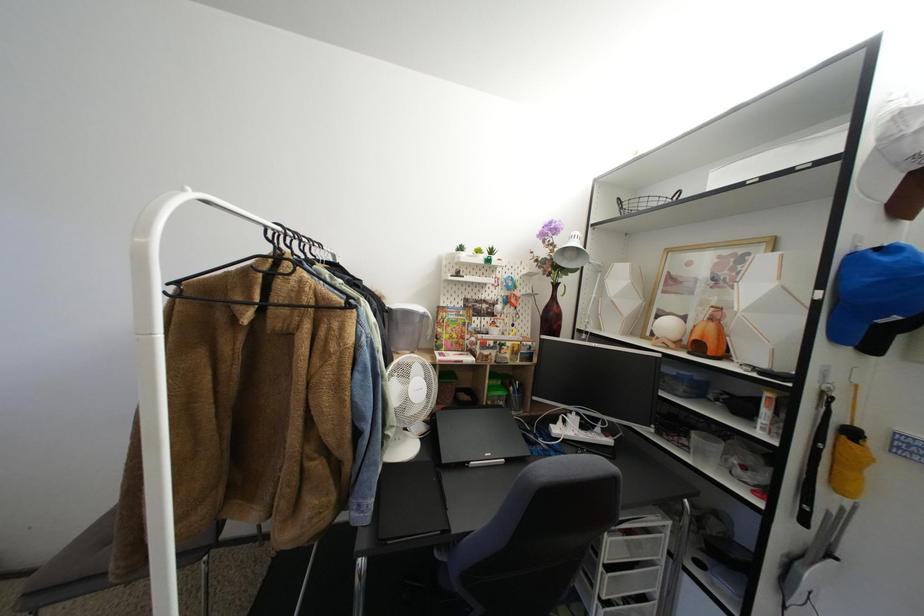
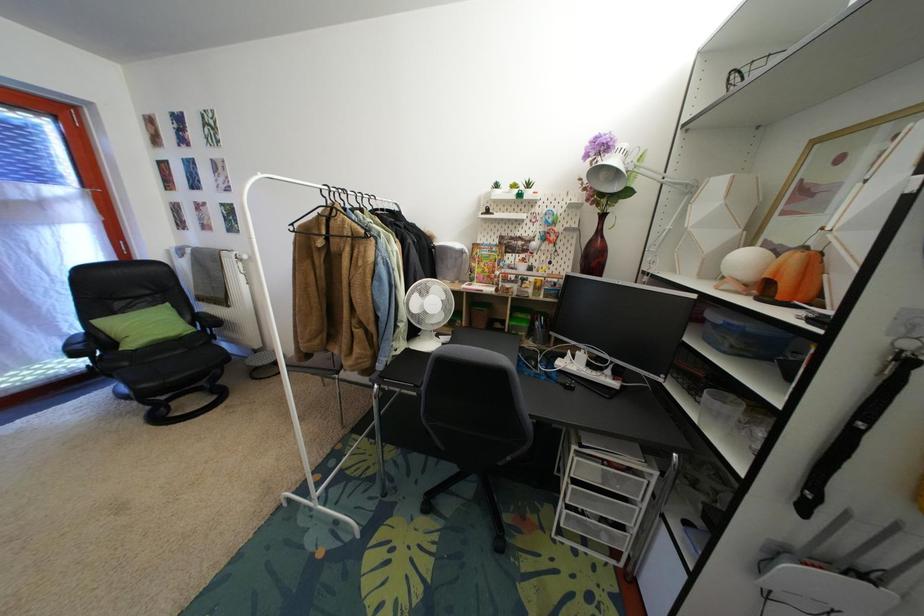
Question: The images are taken continuously from a first-person perspective. In which direction is your viewpoint rotating?

Choices:
 (A) Left
 (B) Right
 (C) Up
 (D) Down

Answer: (A)